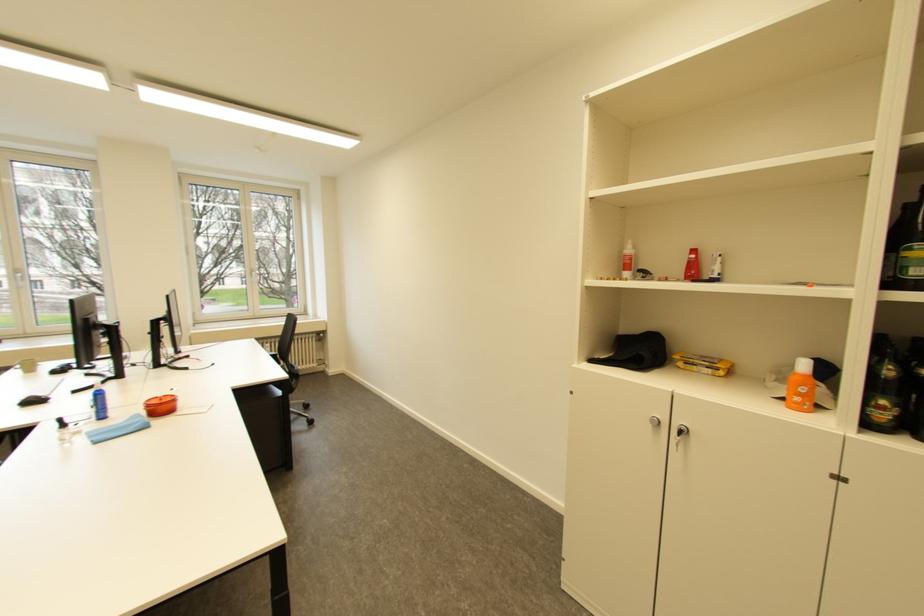
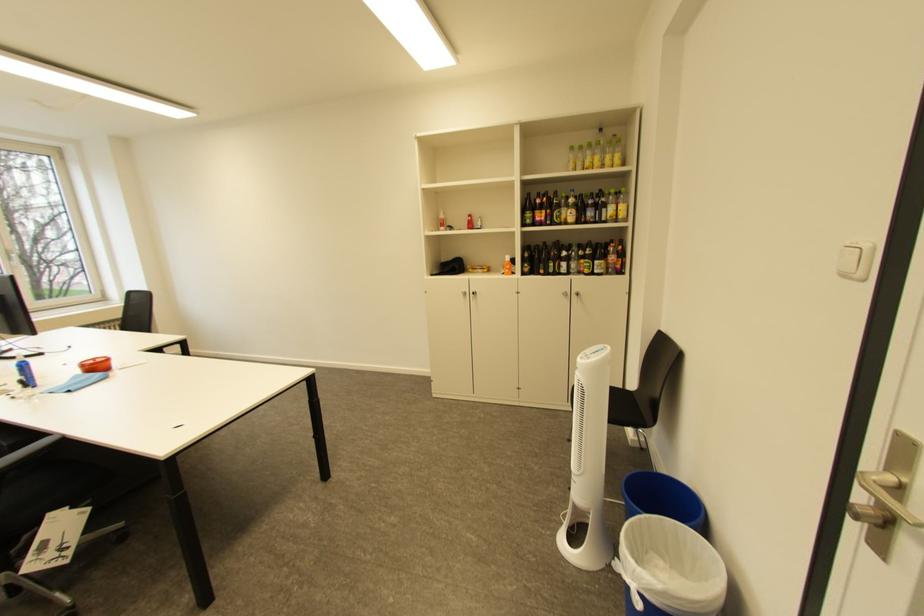
The point at (660, 426) is marked in the first image. Where is the corresponding point in the second image?

(472, 296)